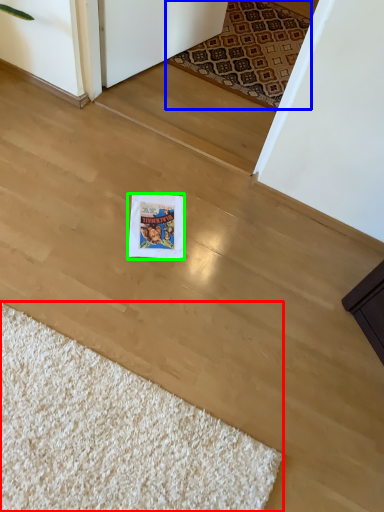
Question: Which is farther away from doormat (highlighted by a red box)? mat (highlighted by a blue box) or postcard (highlighted by a green box)?

Choices:
 (A) mat
 (B) postcard

Answer: (A)